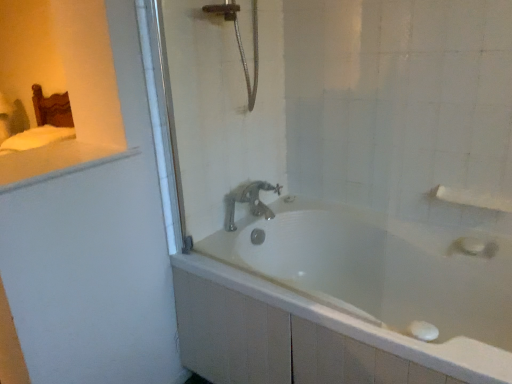
Question: From the image's perspective, is white glossy bathtub at center located above or below polished chrome faucet at center?

Choices:
 (A) above
 (B) below

Answer: (B)

Question: From a real-world perspective, relative to polished chrome faucet at center, is white glossy bathtub at center vertically above or below?

Choices:
 (A) above
 (B) below

Answer: (B)

Question: Which object is positioned closest to the polished chrome faucet at center?

Choices:
 (A) white glossy counter top at upper left
 (B) clear glass shower door at center
 (C) white matte towel bar at upper right
 (D) white glossy bathtub at center

Answer: (B)

Question: Considering the real-world distances, which object is closest to the clear glass shower door at center?

Choices:
 (A) white glossy counter top at upper left
 (B) white glossy bathtub at center
 (C) white matte towel bar at upper right
 (D) polished chrome faucet at center

Answer: (D)